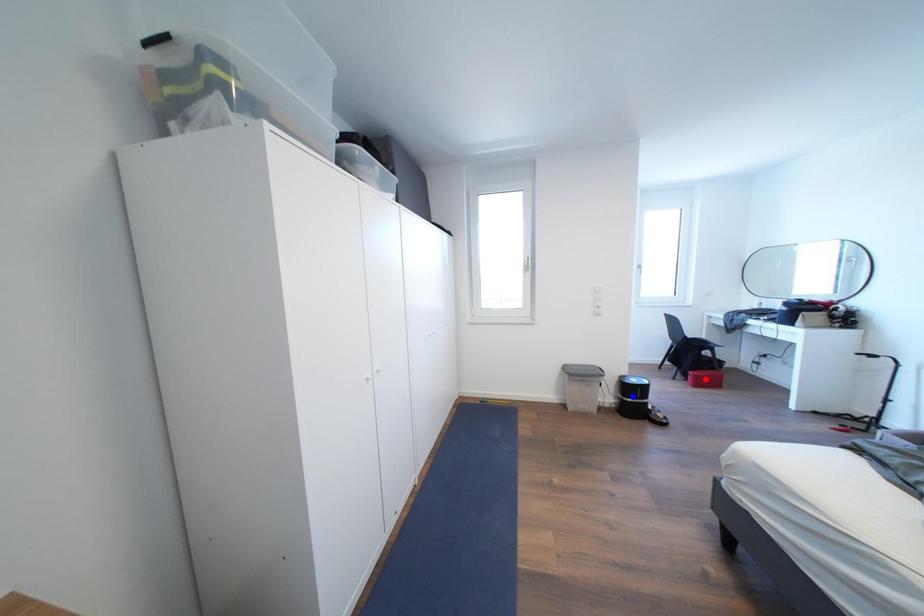
Question: Two points are marked on the image. Which point is closer to the camera?

Choices:
 (A) Blue point is closer.
 (B) Red point is closer.

Answer: (A)